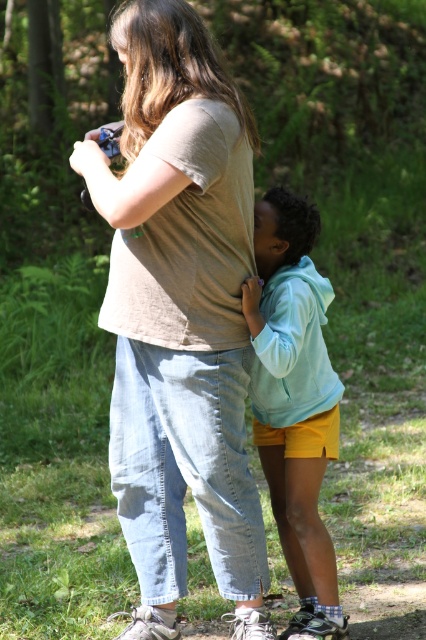
Based on the photo, can you confirm if matte brown shirt at center is positioned to the left of light blue fleece jacket at center?

Yes, matte brown shirt at center is to the left of light blue fleece jacket at center.

Where is `matte brown shirt at center`? Image resolution: width=426 pixels, height=640 pixels. matte brown shirt at center is located at coordinates (180, 314).

In order to click on matte brown shirt at center in this screenshot , I will do `click(180, 314)`.